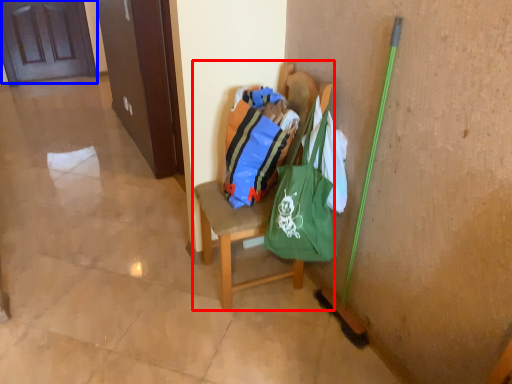
Question: Among these objects, which one is farthest to the camera, chair (highlighted by a red box) or door (highlighted by a blue box)?

Choices:
 (A) chair
 (B) door

Answer: (B)